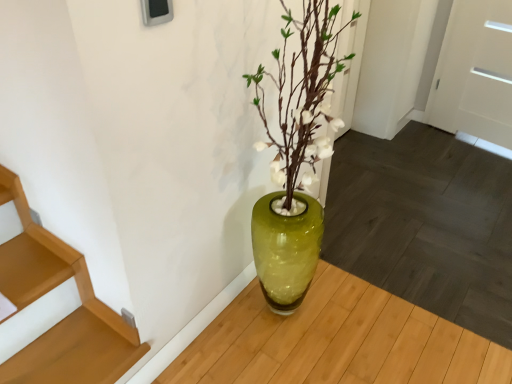
Question: Should I look upward or downward to see wooden stairs at lower left?

Choices:
 (A) down
 (B) up

Answer: (A)

Question: Is white matte door at upper right shorter than wooden stairs at lower left?

Choices:
 (A) no
 (B) yes

Answer: (A)

Question: Could you tell me if white matte door at upper right is turned towards wooden stairs at lower left?

Choices:
 (A) yes
 (B) no

Answer: (A)

Question: Is white matte door at upper right in front of wooden stairs at lower left?

Choices:
 (A) yes
 (B) no

Answer: (B)

Question: Is white matte door at upper right far from wooden stairs at lower left?

Choices:
 (A) yes
 (B) no

Answer: (A)

Question: From a real-world perspective, is white matte door at upper right positioned over wooden stairs at lower left based on gravity?

Choices:
 (A) no
 (B) yes

Answer: (B)

Question: Is white matte door at upper right positioned with its back to wooden stairs at lower left?

Choices:
 (A) yes
 (B) no

Answer: (B)

Question: Considering the relative sizes of wooden stairs at lower left and white matte door at upper right in the image provided, is wooden stairs at lower left thinner than white matte door at upper right?

Choices:
 (A) no
 (B) yes

Answer: (A)

Question: Can you confirm if wooden stairs at lower left is positioned to the left of white matte door at upper right?

Choices:
 (A) no
 (B) yes

Answer: (B)

Question: Considering the relative sizes of wooden stairs at lower left and white matte door at upper right in the image provided, is wooden stairs at lower left smaller than white matte door at upper right?

Choices:
 (A) no
 (B) yes

Answer: (B)

Question: Is wooden stairs at lower left oriented towards white matte door at upper right?

Choices:
 (A) yes
 (B) no

Answer: (B)

Question: Does wooden stairs at lower left have a greater width compared to white matte door at upper right?

Choices:
 (A) yes
 (B) no

Answer: (A)

Question: Could white matte door at upper right be considered to be inside wooden stairs at lower left?

Choices:
 (A) yes
 (B) no

Answer: (B)

Question: In terms of width, does wooden stairs at lower left look wider or thinner when compared to white matte door at upper right?

Choices:
 (A) wide
 (B) thin

Answer: (A)